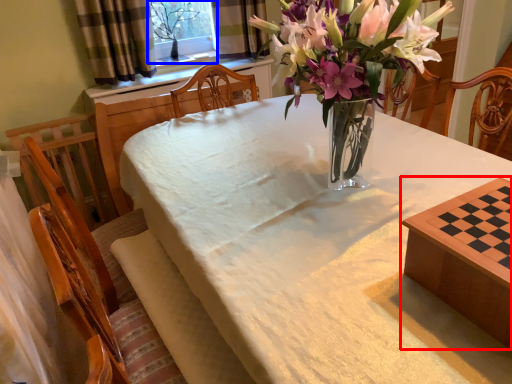
Question: Which object is closer to the camera taking this photo, table (highlighted by a red box) or window screen (highlighted by a blue box)?

Choices:
 (A) table
 (B) window screen

Answer: (A)